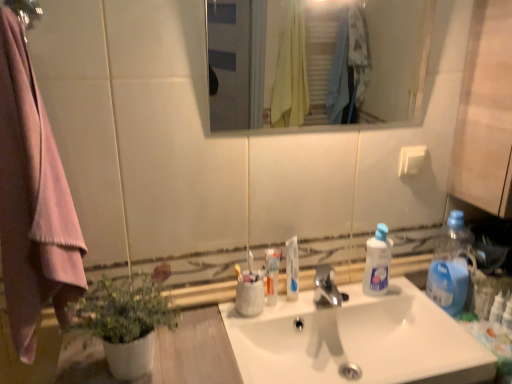
At what (x,y) coordinates should I click in order to perform the action: click on free location to the right of white glossy toothpaste at center, the 1th toothpaste from the left. Please return your answer as a coordinate pair (x, y). Looking at the image, I should click on (321, 307).